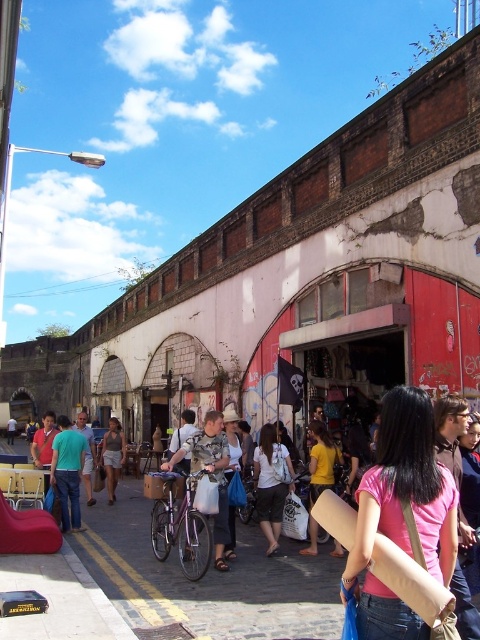
Who is positioned more to the left, matte green shirt at center or light gray cotton shirt at center?

Positioned to the left is matte green shirt at center.

Which of these two, matte green shirt at center or light gray cotton shirt at center, stands taller?

Standing taller between the two is matte green shirt at center.

Is point (72, 493) farther from camera compared to point (103, 451)?

No, it is in front of (103, 451).

Where is `matte green shirt at center`? The height and width of the screenshot is (640, 480). matte green shirt at center is located at coordinates (68, 472).

Is white cotton shirt at center closer to camera compared to light brown leather jacket at center?

No, it is not.

Is white cotton shirt at center below light brown leather jacket at center?

Yes.

In order to click on white cotton shirt at center in this screenshot , I will do `click(271, 483)`.

Does pink matte shirt at center have a greater height compared to green cotton shirt at center?

No, pink matte shirt at center is not taller than green cotton shirt at center.

Does pink matte shirt at center have a lesser width compared to green cotton shirt at center?

Indeed, pink matte shirt at center has a lesser width compared to green cotton shirt at center.

Where is `pink matte shirt at center`? This screenshot has height=640, width=480. pink matte shirt at center is located at coordinates (406, 490).